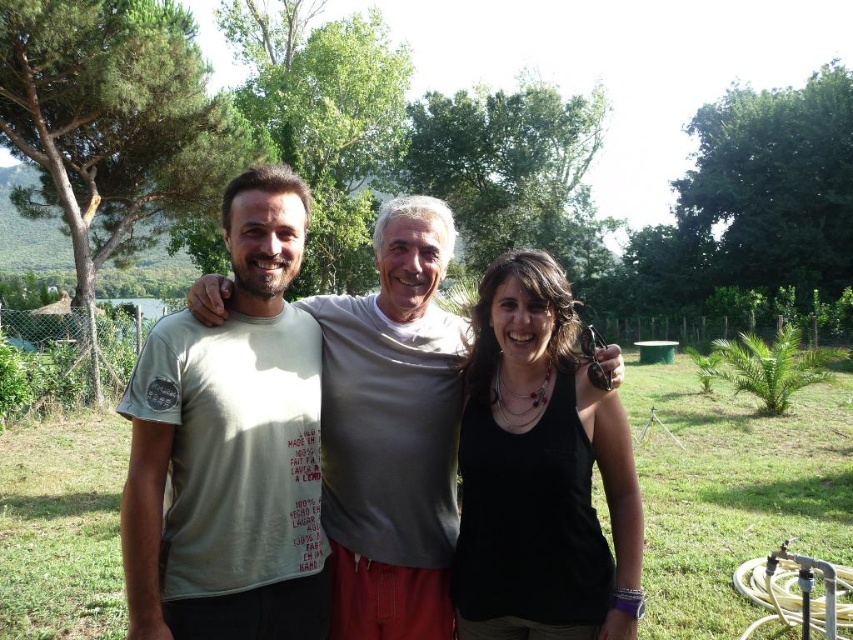
You are a photographer trying to capture the matte gray tshirt at center in a group photo. The camera is set to focus on the point at coordinates point (227, 445). Will this point be on the matte gray tshirt at center?

Yes, the point (227, 445) marks the matte gray tshirt at center, so the camera will focus on it.